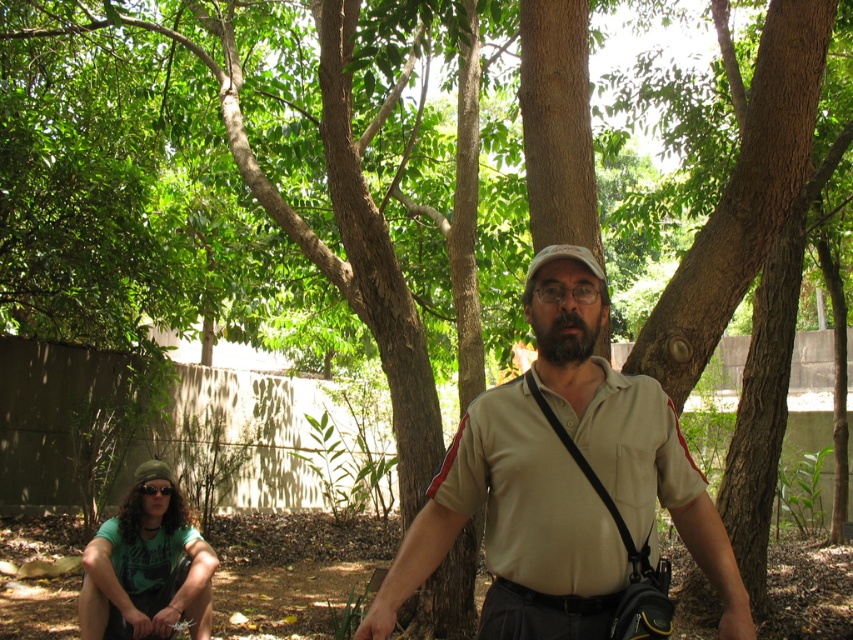
Question: Can you confirm if beige cotton shirt at center is thinner than green fabric shirt at lower left?

Choices:
 (A) yes
 (B) no

Answer: (B)

Question: Considering the relative positions of beige cotton shirt at center and green fabric shirt at lower left in the image provided, where is beige cotton shirt at center located with respect to green fabric shirt at lower left?

Choices:
 (A) below
 (B) above

Answer: (B)

Question: Which point is closer to the camera?

Choices:
 (A) beige cotton shirt at center
 (B) green fabric shirt at lower left

Answer: (A)

Question: Does beige cotton shirt at center have a larger size compared to green fabric shirt at lower left?

Choices:
 (A) no
 (B) yes

Answer: (A)

Question: Among these objects, which one is farthest from the camera?

Choices:
 (A) green fabric shirt at lower left
 (B) beige cotton shirt at center

Answer: (A)